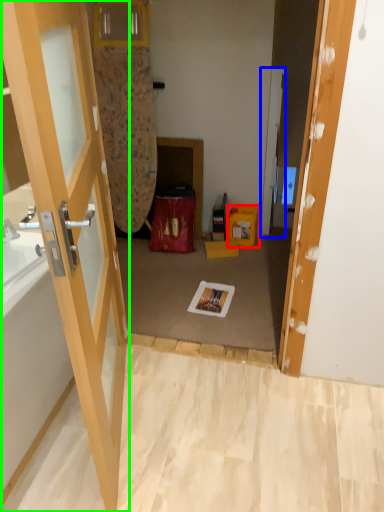
Question: Considering the real-world distances, which object is closest to box (highlighted by a red box)? door (highlighted by a blue box) or door (highlighted by a green box).

Choices:
 (A) door
 (B) door

Answer: (A)